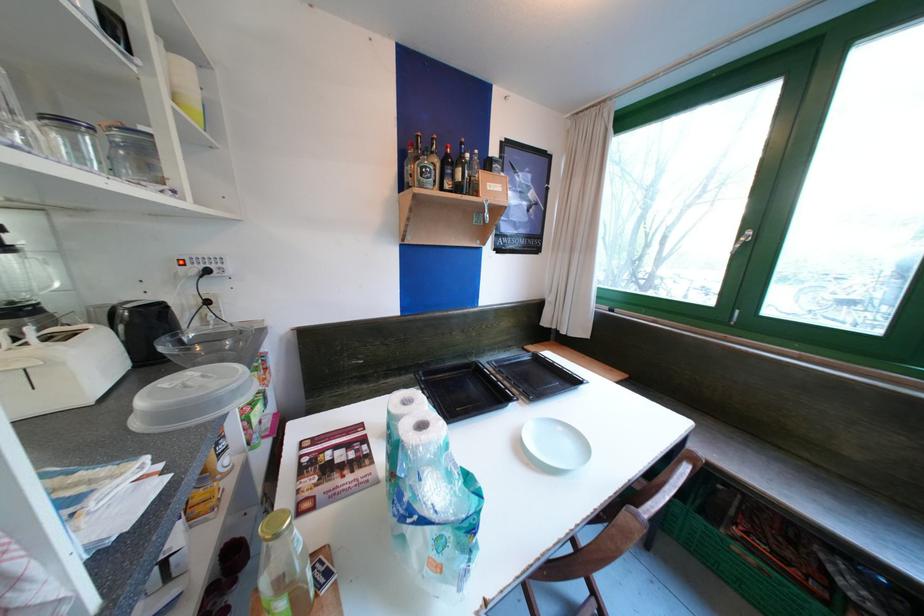
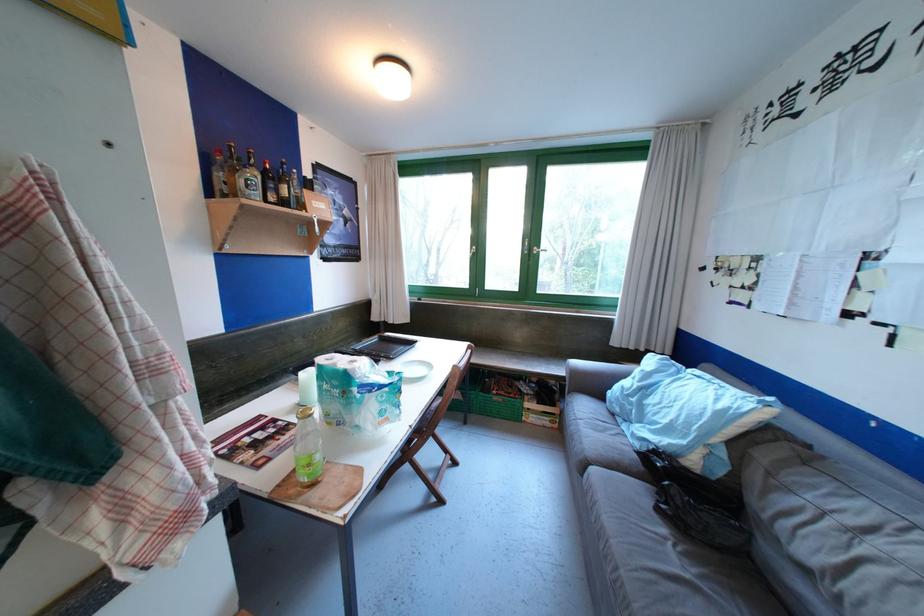
The point at (368, 469) is marked in the first image. Where is the corresponding point in the second image?

(296, 432)